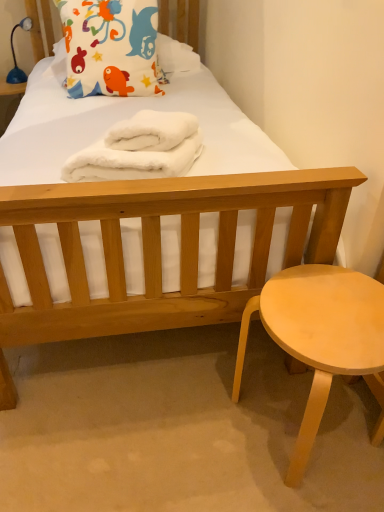
Question: Is white fluffy towels at center touching light wood stool at lower right?

Choices:
 (A) no
 (B) yes

Answer: (A)

Question: Can you confirm if white fluffy towels at center is wider than light wood stool at lower right?

Choices:
 (A) yes
 (B) no

Answer: (A)

Question: Is white fluffy towels at center completely or partially outside of light wood stool at lower right?

Choices:
 (A) yes
 (B) no

Answer: (A)

Question: From the image's perspective, is white fluffy towels at center above light wood stool at lower right?

Choices:
 (A) no
 (B) yes

Answer: (B)

Question: Does white fluffy towels at center have a lesser width compared to light wood stool at lower right?

Choices:
 (A) yes
 (B) no

Answer: (B)

Question: Considering the relative positions of white fluffy towels at center and light wood stool at lower right in the image provided, is white fluffy towels at center to the left of light wood stool at lower right from the viewer's perspective?

Choices:
 (A) no
 (B) yes

Answer: (B)

Question: Is the depth of blue plastic lamp at upper left greater than that of fluffy cotton pillow at upper left?

Choices:
 (A) yes
 (B) no

Answer: (A)

Question: Considering the relative sizes of blue plastic lamp at upper left and fluffy cotton pillow at upper left in the image provided, is blue plastic lamp at upper left thinner than fluffy cotton pillow at upper left?

Choices:
 (A) no
 (B) yes

Answer: (B)

Question: From the image's perspective, would you say blue plastic lamp at upper left is shown under fluffy cotton pillow at upper left?

Choices:
 (A) yes
 (B) no

Answer: (B)

Question: Does blue plastic lamp at upper left have a smaller size compared to fluffy cotton pillow at upper left?

Choices:
 (A) no
 (B) yes

Answer: (B)

Question: Can you confirm if blue plastic lamp at upper left is positioned to the right of fluffy cotton pillow at upper left?

Choices:
 (A) yes
 (B) no

Answer: (B)

Question: Does blue plastic lamp at upper left have a lesser height compared to fluffy cotton pillow at upper left?

Choices:
 (A) yes
 (B) no

Answer: (A)

Question: From a real-world perspective, does light wood stool at lower right sit lower than fluffy cotton pillow at upper left?

Choices:
 (A) yes
 (B) no

Answer: (A)